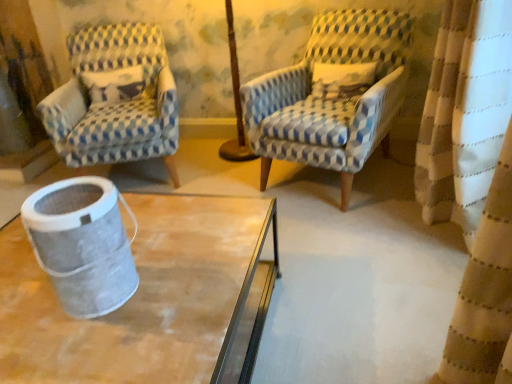
Question: Is blue and white checkered fabric armchair at left, the first chair positioned from the left, a part of metallic mesh trash can at lower left?

Choices:
 (A) no
 (B) yes

Answer: (A)

Question: From a real-world perspective, is metallic mesh trash can at lower left on top of blue and white checkered fabric armchair at left, the 2th chair positioned from the right?

Choices:
 (A) yes
 (B) no

Answer: (A)

Question: From a real-world perspective, is metallic mesh trash can at lower left located beneath blue and white checkered fabric armchair at left, the 2th chair positioned from the right?

Choices:
 (A) no
 (B) yes

Answer: (A)

Question: Does metallic mesh trash can at lower left come behind blue and white checkered fabric armchair at left, the 2th chair positioned from the right?

Choices:
 (A) yes
 (B) no

Answer: (B)

Question: Considering the relative sizes of metallic mesh trash can at lower left and blue and white checkered fabric armchair at left, the first chair positioned from the left, in the image provided, is metallic mesh trash can at lower left thinner than blue and white checkered fabric armchair at left, the first chair positioned from the left,?

Choices:
 (A) yes
 (B) no

Answer: (A)

Question: Is the depth of metallic mesh trash can at lower left less than that of blue and white checkered fabric armchair at left, the first chair positioned from the left?

Choices:
 (A) yes
 (B) no

Answer: (A)

Question: Is the position of blue and white checkered fabric armchair at center, arranged as the second chair when viewed from the left, more distant than that of blue and white checkered fabric armchair at left, the first chair positioned from the left?

Choices:
 (A) yes
 (B) no

Answer: (B)

Question: Is blue and white checkered fabric armchair at center, arranged as the first chair when viewed from the right, positioned in front of blue and white checkered fabric armchair at left, the first chair positioned from the left?

Choices:
 (A) yes
 (B) no

Answer: (A)

Question: Does blue and white checkered fabric armchair at center, arranged as the first chair when viewed from the right, turn towards blue and white checkered fabric armchair at left, the first chair positioned from the left?

Choices:
 (A) no
 (B) yes

Answer: (A)

Question: Is blue and white checkered fabric armchair at center, arranged as the second chair when viewed from the left, placed right next to blue and white checkered fabric armchair at left, the 2th chair positioned from the right?

Choices:
 (A) yes
 (B) no

Answer: (B)

Question: Is blue and white checkered fabric armchair at center, arranged as the first chair when viewed from the right, at the left side of blue and white checkered fabric armchair at left, the first chair positioned from the left?

Choices:
 (A) yes
 (B) no

Answer: (B)

Question: Does blue and white checkered fabric armchair at center, arranged as the first chair when viewed from the right, have a lesser width compared to blue and white checkered fabric armchair at left, the 2th chair positioned from the right?

Choices:
 (A) no
 (B) yes

Answer: (B)

Question: Does blue and white checkered fabric armchair at center, arranged as the first chair when viewed from the right, have a greater height compared to metallic mesh trash can at lower left?

Choices:
 (A) yes
 (B) no

Answer: (A)